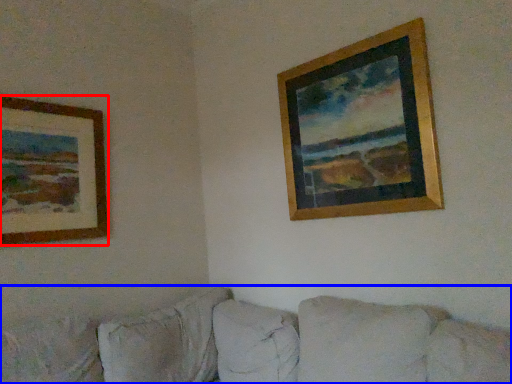
Question: Which of the following is the closest to the observer, picture frame (highlighted by a red box) or studio couch (highlighted by a blue box)?

Choices:
 (A) picture frame
 (B) studio couch

Answer: (B)